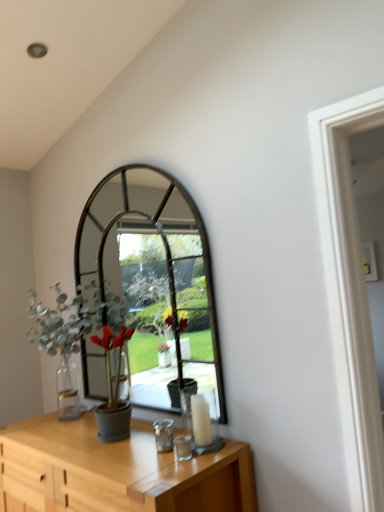
Question: Is green matte plant at left outside of white glass candle at center?

Choices:
 (A) yes
 (B) no

Answer: (A)

Question: Is green matte plant at left thinner than white glass candle at center?

Choices:
 (A) no
 (B) yes

Answer: (A)

Question: From a real-world perspective, is green matte plant at left located higher than white glass candle at center?

Choices:
 (A) yes
 (B) no

Answer: (A)

Question: Is white glass candle at center at the back of green matte plant at left?

Choices:
 (A) no
 (B) yes

Answer: (A)

Question: Does green matte plant at left have a greater width compared to white glass candle at center?

Choices:
 (A) yes
 (B) no

Answer: (A)

Question: From the image's perspective, relative to white glass candle at center, is light wood table at lower center above or below?

Choices:
 (A) below
 (B) above

Answer: (A)

Question: Is point (67, 433) positioned closer to the camera than point (190, 395)?

Choices:
 (A) farther
 (B) closer

Answer: (A)

Question: From a real-world perspective, relative to white glass candle at center, is light wood table at lower center vertically above or below?

Choices:
 (A) below
 (B) above

Answer: (A)

Question: Would you say light wood table at lower center is to the left or to the right of white glass candle at center in the picture?

Choices:
 (A) right
 (B) left

Answer: (B)

Question: Based on their sizes in the image, would you say light wood table at lower center is bigger or smaller than green matte plant at left?

Choices:
 (A) big
 (B) small

Answer: (A)

Question: Is light wood table at lower center situated inside green matte plant at left or outside?

Choices:
 (A) inside
 (B) outside

Answer: (B)

Question: Is light wood table at lower center in front of or behind green matte plant at left in the image?

Choices:
 (A) front
 (B) behind

Answer: (A)

Question: Would you say light wood table at lower center is to the left or to the right of green matte plant at left in the picture?

Choices:
 (A) left
 (B) right

Answer: (B)

Question: Is green matte plant at left taller or shorter than white glass candle at center?

Choices:
 (A) tall
 (B) short

Answer: (A)

Question: From the image's perspective, is green matte plant at left positioned above or below white glass candle at center?

Choices:
 (A) above
 (B) below

Answer: (A)